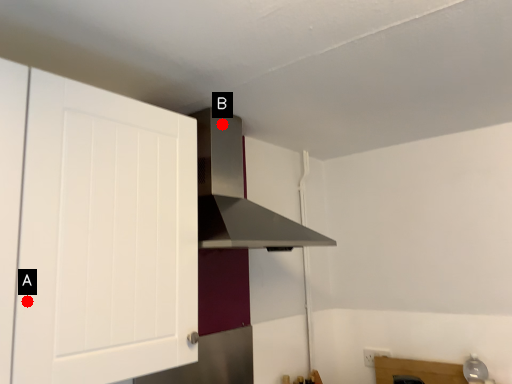
Question: Two points are circled on the image, labeled by A and B beside each circle. Which of the following is the farthest from the observer?

Choices:
 (A) A is further
 (B) B is further

Answer: (B)